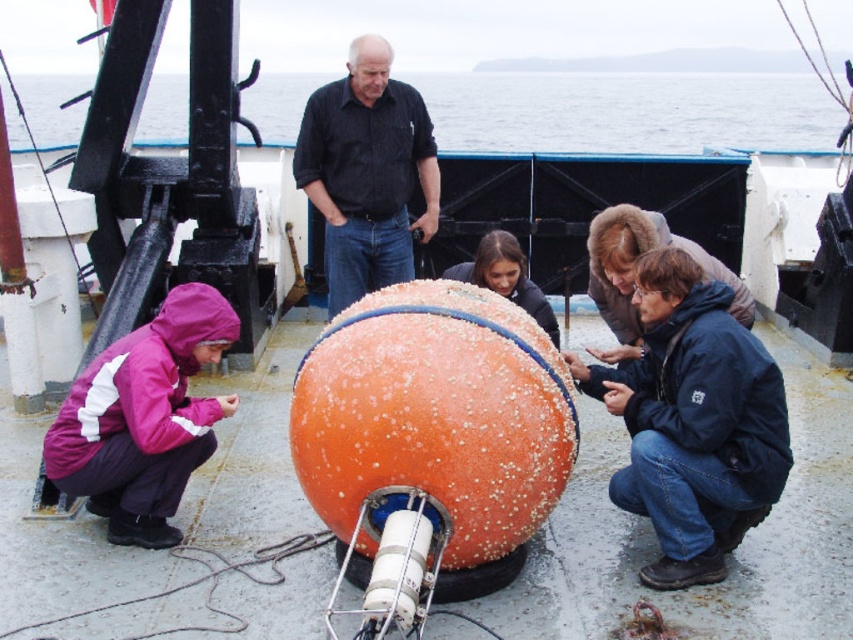
Question: Which of the following is the closest to the observer?

Choices:
 (A) (679, 376)
 (B) (96, 410)

Answer: (A)

Question: Which object appears farthest from the camera in this image?

Choices:
 (A) pink fabric jacket at lower left
 (B) orange rubber buoy at center

Answer: (B)

Question: Considering the relative positions of orange matte buoy at lower center and pink fabric jacket at lower left in the image provided, where is orange matte buoy at lower center located with respect to pink fabric jacket at lower left?

Choices:
 (A) left
 (B) right

Answer: (B)

Question: Does orange matte buoy at lower center have a larger size compared to pink fabric jacket at lower left?

Choices:
 (A) yes
 (B) no

Answer: (A)

Question: Can you confirm if orange matte buoy at lower center is positioned above black striped shirt at upper center?

Choices:
 (A) no
 (B) yes

Answer: (A)

Question: Among these points, which one is nearest to the camera?

Choices:
 (A) (107, 474)
 (B) (405, 192)

Answer: (A)